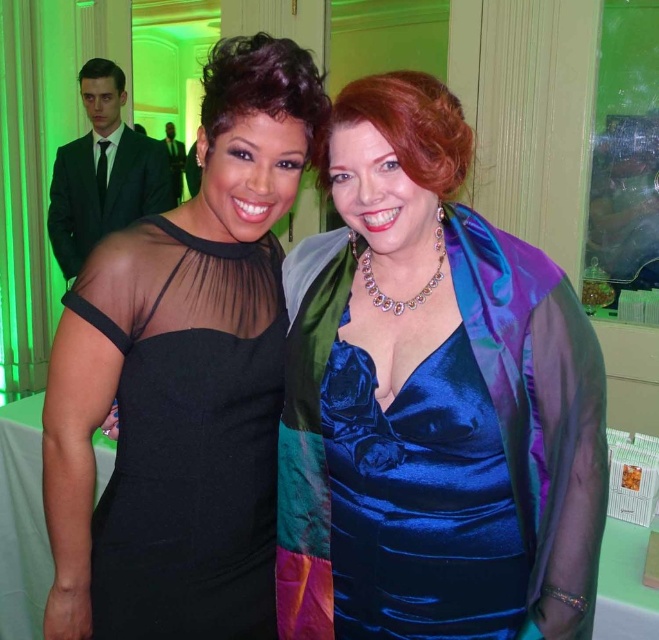
Question: Where is satin blue dress at center located in relation to shiny blue dress at center in the image?

Choices:
 (A) below
 (B) above

Answer: (B)

Question: Is satin blue dress at center positioned before shiny blue dress at center?

Choices:
 (A) no
 (B) yes

Answer: (B)

Question: Which object is the closest to the shiny blue dress at center?

Choices:
 (A) satin blue dress at center
 (B) black sheer dress at center

Answer: (A)

Question: Where is satin blue dress at center located in relation to black sheer dress at center in the image?

Choices:
 (A) above
 (B) below

Answer: (B)

Question: Which of the following is the closest to the observer?

Choices:
 (A) (391, 624)
 (B) (530, 268)
 (C) (181, 630)

Answer: (B)

Question: Which object appears closest to the camera in this image?

Choices:
 (A) shiny blue dress at center
 (B) satin blue dress at center

Answer: (B)